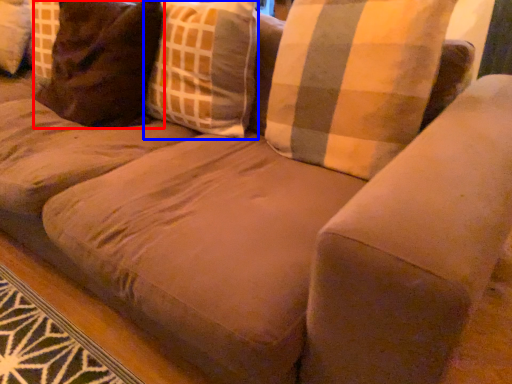
Question: Which object is closer to the camera taking this photo, pillow (highlighted by a red box) or throw pillow (highlighted by a blue box)?

Choices:
 (A) pillow
 (B) throw pillow

Answer: (B)